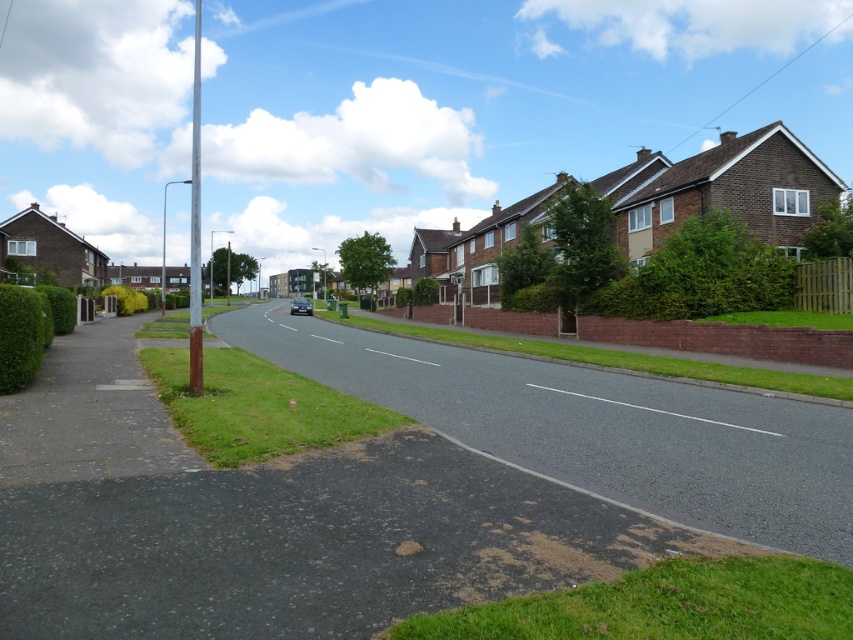
You are standing on the sidewalk and want to cross the asphalt road at center to reach the houses on the other side. If your walking speed is 1.5 meters per second, will you be able to cross the road safely within 5 seconds?

The asphalt road at center is 5.10 meters away from the viewer. To cross this distance at a speed of 1.5 meters per second, it would take approximately 3.4 seconds. Since 3.4 seconds is less than 5 seconds, you can safely cross the road within the given time.